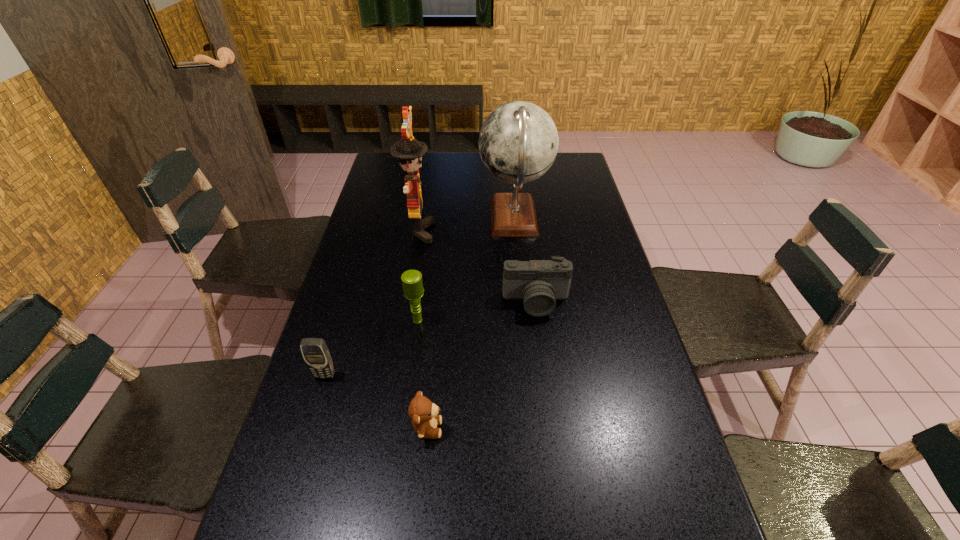
This screenshot has height=540, width=960. I want to click on nutcracker, so click(x=410, y=151).

You are a GUI agent. You are given a task and a screenshot of the screen. Output one action in this format:
    pyautogui.click(x=<x>, y=<y>)
    Task: Click on the globe
    The height and width of the screenshot is (540, 960).
    Given the screenshot: What is the action you would take?
    pyautogui.click(x=518, y=142)

Identify the location of the fourth shortest object. The width and height of the screenshot is (960, 540). (412, 283).

I want to click on the second nearest object, so click(x=316, y=354).

Find the location of `cellular telephone`. cellular telephone is located at coordinates (316, 354).

Find the location of `camera`. camera is located at coordinates (539, 283).

The height and width of the screenshot is (540, 960). Find the location of `teddy bear`. teddy bear is located at coordinates (424, 413).

The width and height of the screenshot is (960, 540). In order to click on the nearest object in this screenshot , I will do `click(424, 413)`.

The width and height of the screenshot is (960, 540). What are the coordinates of `blank space located on the front-facing side of the nutcracker` in the screenshot? It's located at (547, 231).

Locate an element on the screen. vacant space located 0.080m at the equator of the globe is located at coordinates click(457, 218).